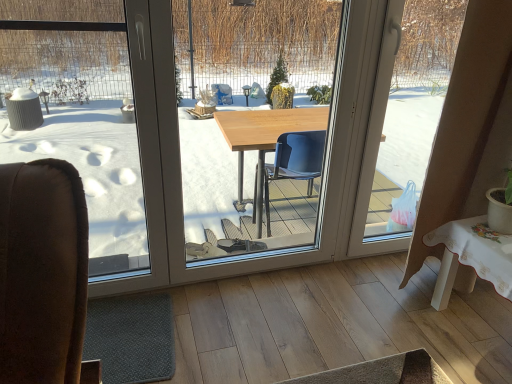
Image resolution: width=512 pixels, height=384 pixels. I want to click on free space above gray rubber mat at lower left (from a real-world perspective), so (142, 326).